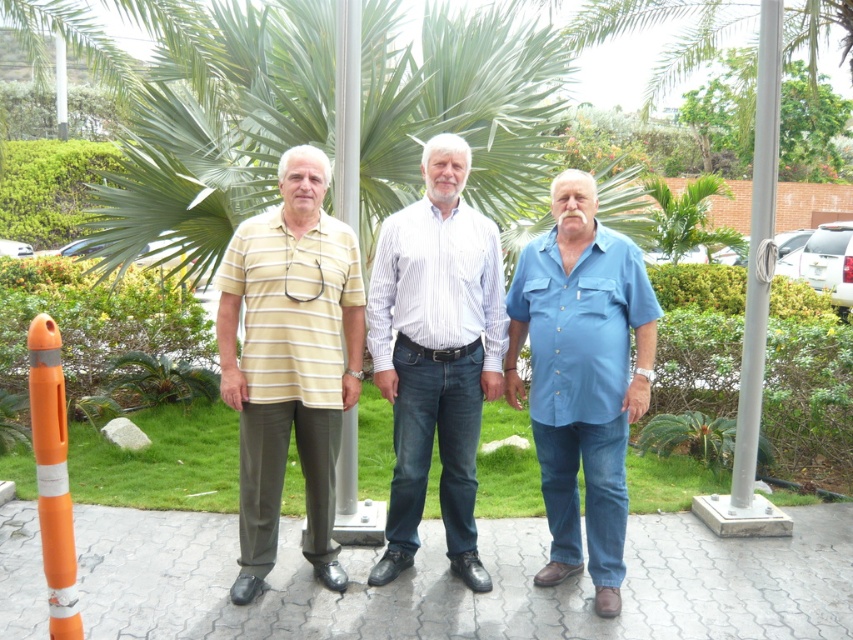
This screenshot has width=853, height=640. What do you see at coordinates (289, 362) in the screenshot?
I see `yellow striped shirt at center` at bounding box center [289, 362].

Does yellow striped shirt at center have a greater width compared to orange matte traffic cone at left?

Correct, the width of yellow striped shirt at center exceeds that of orange matte traffic cone at left.

Does point (289, 340) lie behind point (68, 588)?

Yes, it is behind point (68, 588).

In order to click on yellow striped shirt at center in this screenshot , I will do `click(289, 362)`.

Does striped cotton polo shirt at center have a lesser width compared to green leafy palm tree at center?

Correct, striped cotton polo shirt at center's width is less than green leafy palm tree at center's.

I want to click on striped cotton polo shirt at center, so click(x=439, y=355).

Is point (463, 572) closer to viewer compared to point (685, 212)?

Yes, it is in front of point (685, 212).

The image size is (853, 640). I want to click on striped cotton polo shirt at center, so click(439, 355).

Does yellow striped shirt at center have a larger size compared to metallic pole at center?

Yes.

Which is in front, point (335, 243) or point (341, 417)?

Point (335, 243)

Locate an element on the screen. yellow striped shirt at center is located at coordinates (289, 362).